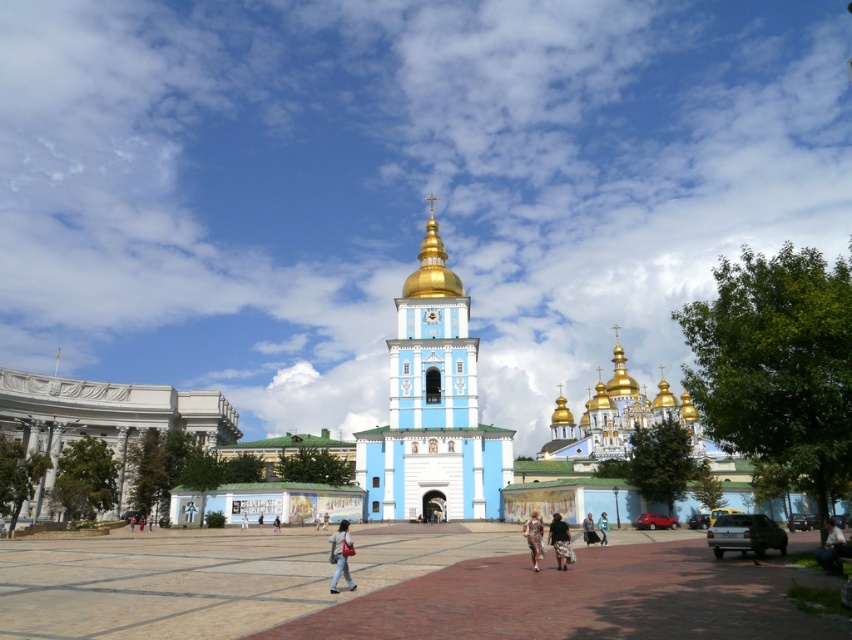
You are standing in the square in front of the church and want to walk towards the two points marked on the ground. The first point is at coordinate point(x=465, y=508) and the second is at point(x=582, y=525). Which point will you reach first if you walk straight towards them?

You will reach point(x=465, y=508) first because it is closer to you than point(x=582, y=525), which is further away.

You are standing in the square and see the gold domed church at center and the light blue jeans at lower right. Which object is closer to the right side of the square?

The gold domed church at center is to the right of light blue jeans at lower right, so the gold domed church at center is closer to the right side of the square.

You are standing in the square in front of the church and notice the blue painted stone tower at center and the dark gray fabric pants at center. Which object is positioned higher in the scene?

The blue painted stone tower at center is located above the dark gray fabric pants at center, so it is positioned higher in the scene.